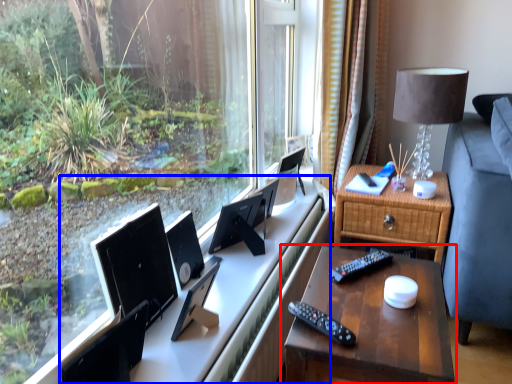
Question: Which of the following is the farthest to the observer, nightstand (highlighted by a red box) or computer desk (highlighted by a blue box)?

Choices:
 (A) nightstand
 (B) computer desk

Answer: (B)